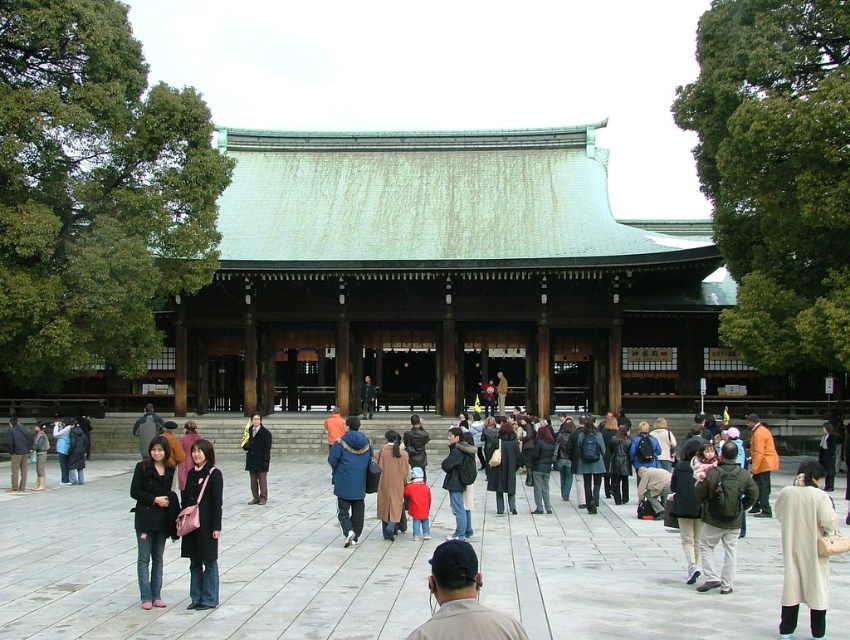
Question: Based on their relative distances, which object is farther from the dark brown leather coat at center?

Choices:
 (A) dark blue backpack at center
 (B) dark gray fabric coat at lower right
 (C) beige wool coat at lower right
 (D) dark blue jeans at center

Answer: (C)

Question: Can you confirm if blue denim jacket at center is thinner than dark gray fabric coat at lower right?

Choices:
 (A) yes
 (B) no

Answer: (B)

Question: Observing the image, what is the correct spatial positioning of beige wool coat at lower right in reference to black leather jacket at lower left?

Choices:
 (A) below
 (B) above

Answer: (A)

Question: Is brown wool coat at center smaller than dark blue jeans at center?

Choices:
 (A) no
 (B) yes

Answer: (A)

Question: Considering the real-world distances, which object is closest to the dark blue backpack at center?

Choices:
 (A) dark blue jeans at center
 (B) brown wool coat at center
 (C) black leather jacket at lower left

Answer: (A)

Question: Which point is farther from the camera taking this photo?

Choices:
 (A) (588, 429)
 (B) (710, 484)

Answer: (A)